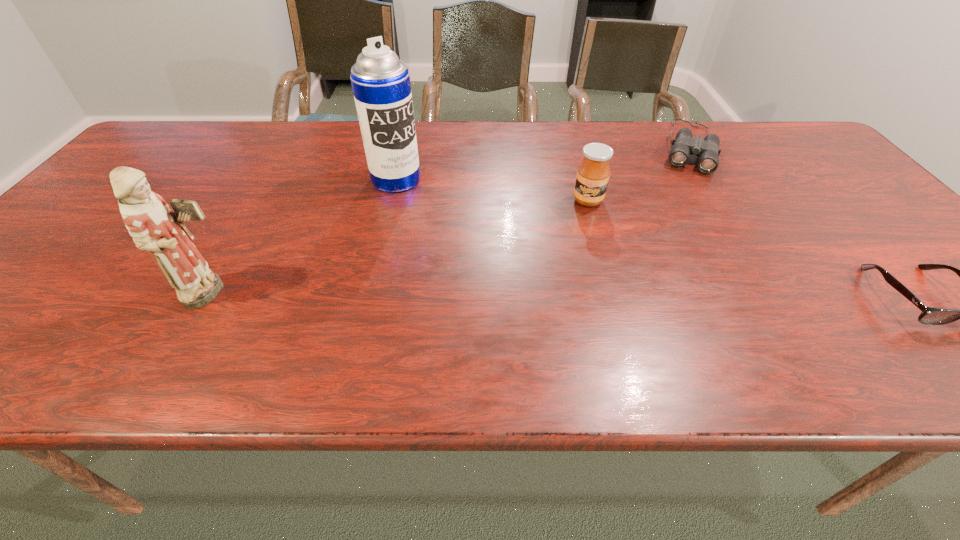
Identify the location of figurine. The width and height of the screenshot is (960, 540). (154, 227).

Image resolution: width=960 pixels, height=540 pixels. Identify the location of the leftmost object. (154, 227).

I want to click on the third object from left to right, so click(x=593, y=174).

Find the location of a particular element. This screenshot has height=540, width=960. the third tallest object is located at coordinates (593, 174).

The image size is (960, 540). I want to click on the second object from right to left, so click(707, 150).

You are a GUI agent. You are given a task and a screenshot of the screen. Output one action in this format:
    pyautogui.click(x=<x>, y=<y>)
    Task: Click on the tallest object
    
    Given the screenshot: What is the action you would take?
    coord(381,86)

I want to click on the second object from left to right, so click(381, 86).

You are a GUI agent. You are given a task and a screenshot of the screen. Output one action in this format:
    pyautogui.click(x=<x>, y=<y>)
    Task: Click on the free region located on the front-facing side of the leftmost object
    This screenshot has width=960, height=540.
    Given the screenshot: What is the action you would take?
    pyautogui.click(x=338, y=293)

I want to click on blank space located on the front-facing side of the honey, so click(586, 255).

At what (x,y) coordinates should I click in order to perform the action: click on vacant space located on the front-facing side of the honey. Please return your answer as a coordinate pair (x, y). Image resolution: width=960 pixels, height=540 pixels. Looking at the image, I should click on tap(583, 306).